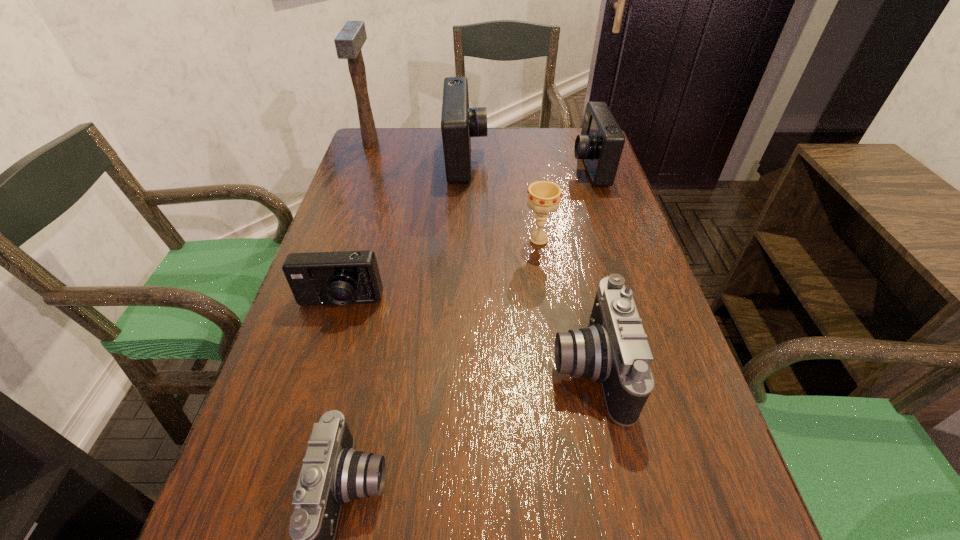
Where is `free spot located 0.230m on the right of the mallet`? free spot located 0.230m on the right of the mallet is located at coordinates (451, 145).

The width and height of the screenshot is (960, 540). I want to click on vacant space located on the front-facing side of the biggest blue camera, so click(x=566, y=160).

The width and height of the screenshot is (960, 540). Find the location of `vacant space located 0.120m on the front-facing side of the rightmost camera`. vacant space located 0.120m on the front-facing side of the rightmost camera is located at coordinates (531, 167).

I want to click on free space located on the front-facing side of the rightmost camera, so point(524,167).

Identify the location of blank area located 0.160m on the front-facing side of the rightmost camera. This screenshot has height=540, width=960. (517, 167).

Find the location of a particular element. blank space located 0.380m on the front-facing side of the second nearest camera is located at coordinates (348, 368).

I want to click on vacant position located 0.110m on the front-facing side of the second nearest camera, so click(494, 368).

Where is `free point located 0.190m on the front-facing side of the second nearest camera`? This screenshot has width=960, height=540. free point located 0.190m on the front-facing side of the second nearest camera is located at coordinates [x=451, y=368].

You are a GUI agent. You are given a task and a screenshot of the screen. Output one action in this format:
    pyautogui.click(x=<x>, y=<y>)
    Task: Click on the vacant space located on the back of the fourth nearest object
    The width and height of the screenshot is (960, 540).
    Given the screenshot: What is the action you would take?
    pyautogui.click(x=527, y=158)

I want to click on vacant space located 0.330m on the front-facing side of the leftmost blue camera, so click(285, 484).